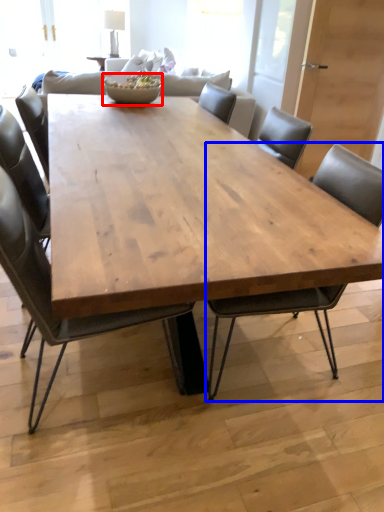
Question: Which object appears farthest to the camera in this image, bowl (highlighted by a red box) or chair (highlighted by a blue box)?

Choices:
 (A) bowl
 (B) chair

Answer: (A)